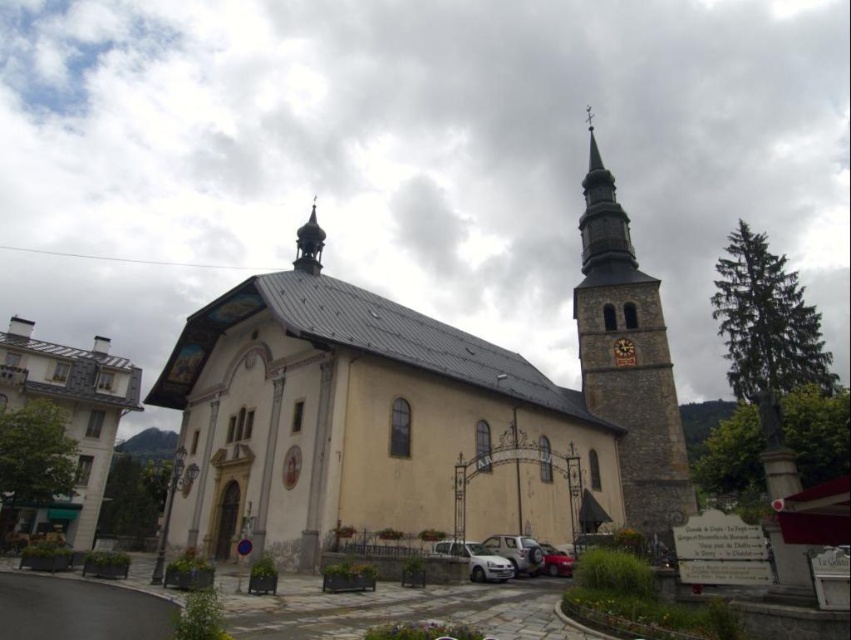
Can you confirm if white matte car at lower center is positioned above gold textured dome at upper center?

No, white matte car at lower center is not above gold textured dome at upper center.

Between white matte car at lower center and gold textured dome at upper center, which one appears on the left side from the viewer's perspective?

Positioned to the left is gold textured dome at upper center.

Locate an element on the screen. This screenshot has height=640, width=851. white matte car at lower center is located at coordinates (477, 561).

Between silver metallic car at lower center and metallic silver car at lower center, which one appears on the right side from the viewer's perspective?

metallic silver car at lower center is more to the right.

Which is above, silver metallic car at lower center or metallic silver car at lower center?

silver metallic car at lower center is above.

This screenshot has height=640, width=851. Find the location of `silver metallic car at lower center`. silver metallic car at lower center is located at coordinates (517, 552).

The image size is (851, 640). What are the coordinates of `silver metallic car at lower center` in the screenshot? It's located at (517, 552).

Who is more distant from viewer, (318, 260) or (552, 557)?

Point (318, 260)

Is point (298, 237) farther from camera compared to point (543, 564)?

Yes, it is.

The image size is (851, 640). Describe the element at coordinates (309, 244) in the screenshot. I see `gold textured dome at upper center` at that location.

Locate an element on the screen. gold textured dome at upper center is located at coordinates (309, 244).